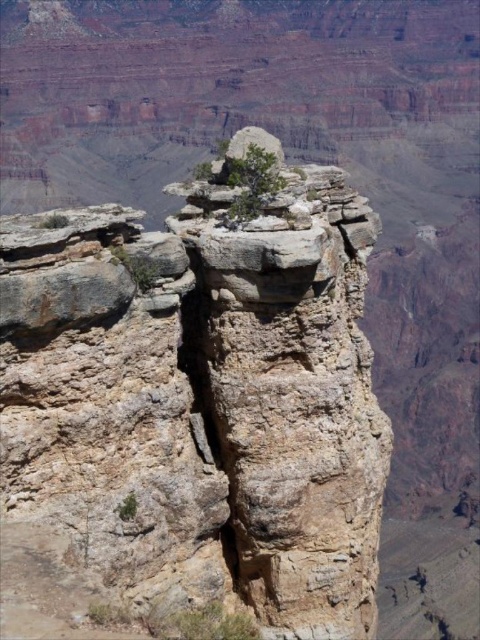
Question: Does rusty stone rock formation at center appear under green matte tree at center?

Choices:
 (A) no
 (B) yes

Answer: (B)

Question: Is rusty stone rock formation at center above green matte tree at center?

Choices:
 (A) yes
 (B) no

Answer: (B)

Question: Which point appears closest to the camera in this image?

Choices:
 (A) (303, 410)
 (B) (267, 164)

Answer: (B)

Question: Which point appears closest to the camera in this image?

Choices:
 (A) (28, 408)
 (B) (248, 166)

Answer: (A)

Question: Can you confirm if rusty stone rock formation at center is positioned above green matte tree at center?

Choices:
 (A) no
 (B) yes

Answer: (A)

Question: Which point appears farthest from the camera in this image?

Choices:
 (A) (236, 204)
 (B) (320, 436)

Answer: (B)